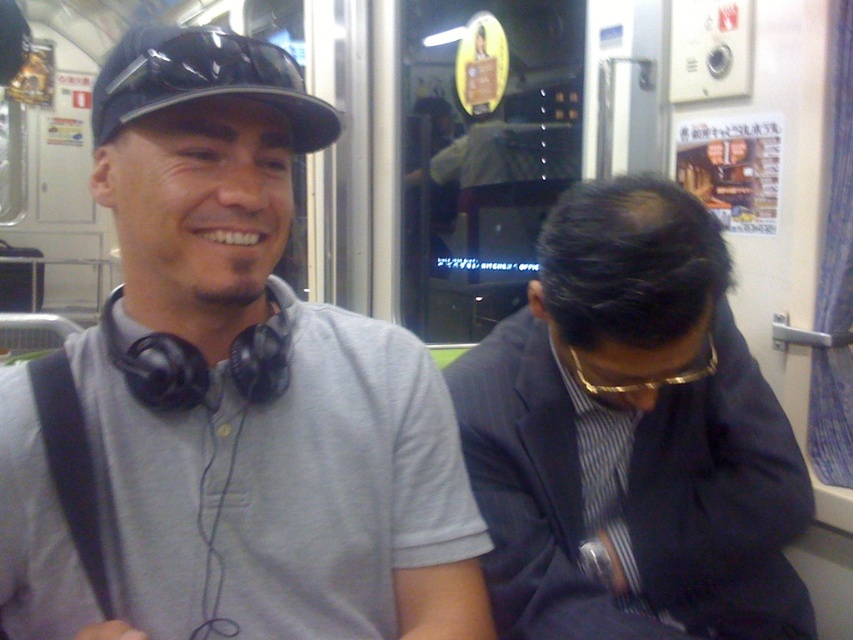
Can you confirm if dark blue pinstripe suit at center is shorter than black glossy baseball cap at upper left?

In fact, dark blue pinstripe suit at center may be taller than black glossy baseball cap at upper left.

Can you confirm if dark blue pinstripe suit at center is smaller than black glossy baseball cap at upper left?

Incorrect, dark blue pinstripe suit at center is not smaller in size than black glossy baseball cap at upper left.

This screenshot has width=853, height=640. What are the coordinates of `dark blue pinstripe suit at center` in the screenshot? It's located at (631, 436).

What are the coordinates of `dark blue pinstripe suit at center` in the screenshot? It's located at (631, 436).

Can you confirm if gray matte shirt at center is positioned below dark blue pinstripe suit at center?

No, gray matte shirt at center is not below dark blue pinstripe suit at center.

Is gray matte shirt at center taller than dark blue pinstripe suit at center?

In fact, gray matte shirt at center may be shorter than dark blue pinstripe suit at center.

What do you see at coordinates (236, 392) in the screenshot? I see `gray matte shirt at center` at bounding box center [236, 392].

Image resolution: width=853 pixels, height=640 pixels. I want to click on gray matte shirt at center, so click(236, 392).

In the scene shown: Does gray matte shirt at center appear under black glossy baseball cap at upper left?

Yes, gray matte shirt at center is below black glossy baseball cap at upper left.

Is gray matte shirt at center above black glossy baseball cap at upper left?

Actually, gray matte shirt at center is below black glossy baseball cap at upper left.

Is point (132, 108) farther from viewer compared to point (175, 33)?

That is False.

Locate an element on the screen. gray matte shirt at center is located at coordinates (236, 392).